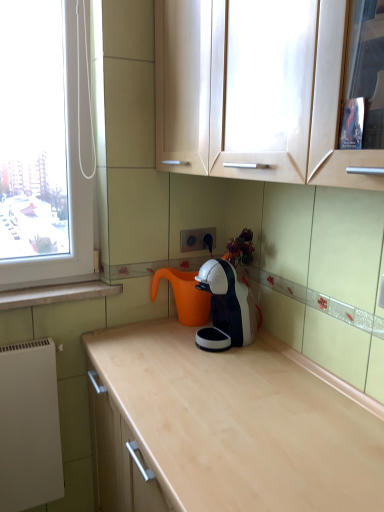
Question: Should I look upward or downward to see white matte radiator at lower left?

Choices:
 (A) down
 (B) up

Answer: (A)

Question: Is white matte radiator at lower left thinner than white marble window sill at lower left?

Choices:
 (A) yes
 (B) no

Answer: (A)

Question: Is white matte radiator at lower left beside white marble window sill at lower left?

Choices:
 (A) no
 (B) yes

Answer: (A)

Question: Considering the relative positions of white matte radiator at lower left and white marble window sill at lower left in the image provided, is white matte radiator at lower left in front of white marble window sill at lower left?

Choices:
 (A) yes
 (B) no

Answer: (A)

Question: Can you confirm if white matte radiator at lower left is positioned to the left of white marble window sill at lower left?

Choices:
 (A) no
 (B) yes

Answer: (B)

Question: From a real-world perspective, is white matte radiator at lower left located beneath white marble window sill at lower left?

Choices:
 (A) yes
 (B) no

Answer: (A)

Question: From a real-world perspective, is white matte radiator at lower left positioned over white marble window sill at lower left based on gravity?

Choices:
 (A) yes
 (B) no

Answer: (B)

Question: Is white matte radiator at lower left oriented towards white plastic electric outlet at center?

Choices:
 (A) yes
 (B) no

Answer: (B)

Question: From the image's perspective, is white matte radiator at lower left under white plastic electric outlet at center?

Choices:
 (A) yes
 (B) no

Answer: (A)

Question: Considering the relative sizes of white matte radiator at lower left and white plastic electric outlet at center in the image provided, is white matte radiator at lower left shorter than white plastic electric outlet at center?

Choices:
 (A) no
 (B) yes

Answer: (A)

Question: Considering the relative sizes of white matte radiator at lower left and white plastic electric outlet at center in the image provided, is white matte radiator at lower left taller than white plastic electric outlet at center?

Choices:
 (A) yes
 (B) no

Answer: (A)

Question: Is white plastic electric outlet at center surrounded by white matte radiator at lower left?

Choices:
 (A) no
 (B) yes

Answer: (A)

Question: Does white matte radiator at lower left have a smaller size compared to white plastic electric outlet at center?

Choices:
 (A) yes
 (B) no

Answer: (B)

Question: From the image's perspective, is white plastic electric outlet at center on top of white glossy coffee machine at center?

Choices:
 (A) yes
 (B) no

Answer: (A)